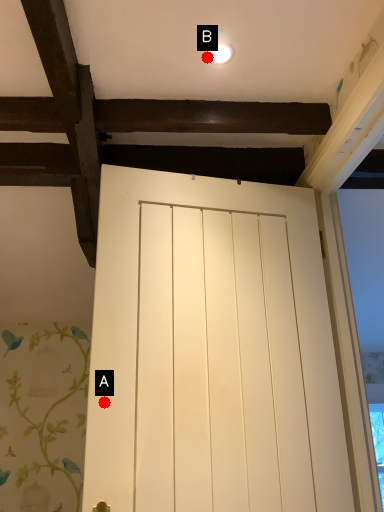
Question: Two points are circled on the image, labeled by A and B beside each circle. Which of the following is the farthest from the observer?

Choices:
 (A) A is further
 (B) B is further

Answer: (B)